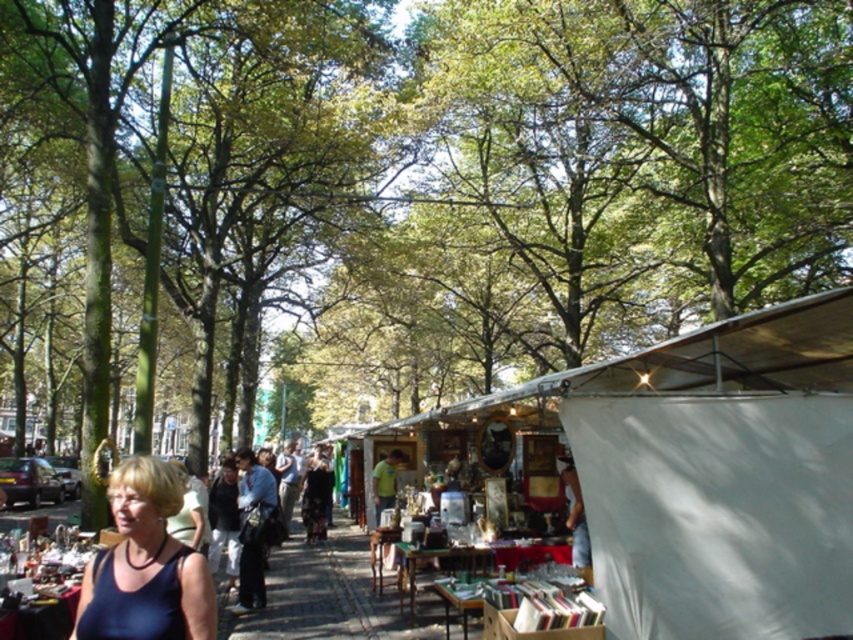
Looking at this image, you are a customer at the market and want to know if the white fabric canopy at center can provide shade for the matte blue tank top at lower left. Can you determine this based on their heights?

The white fabric canopy at center is taller than the matte blue tank top at lower left, so it can provide shade for the matte blue tank top at lower left.

You are standing at the entrance of the market and see two points marked in the scene. Which point is closer to you, point (x=833, y=353) or point (x=84, y=593)?

Point (x=84, y=593) is closer to you because it is less further to the viewer than point (x=833, y=353).